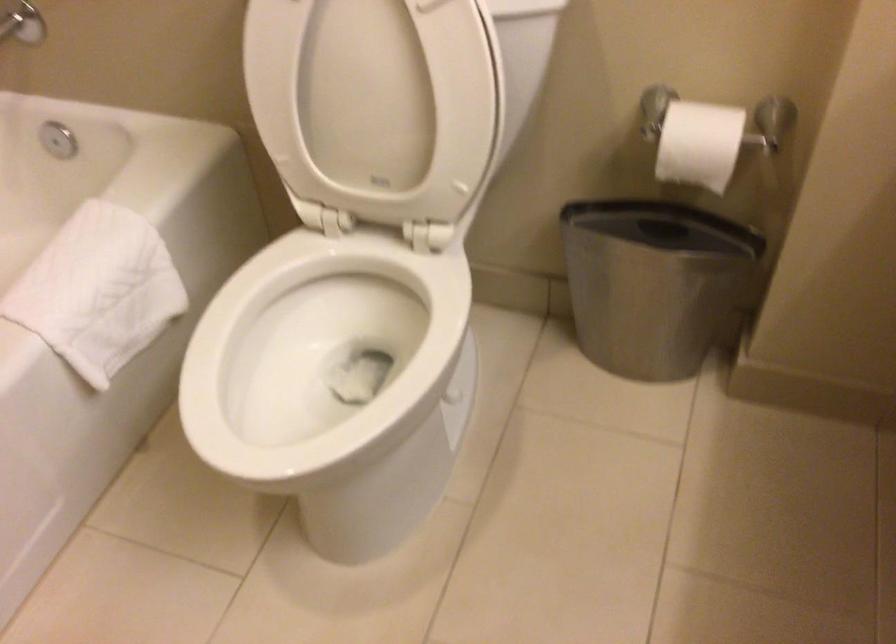
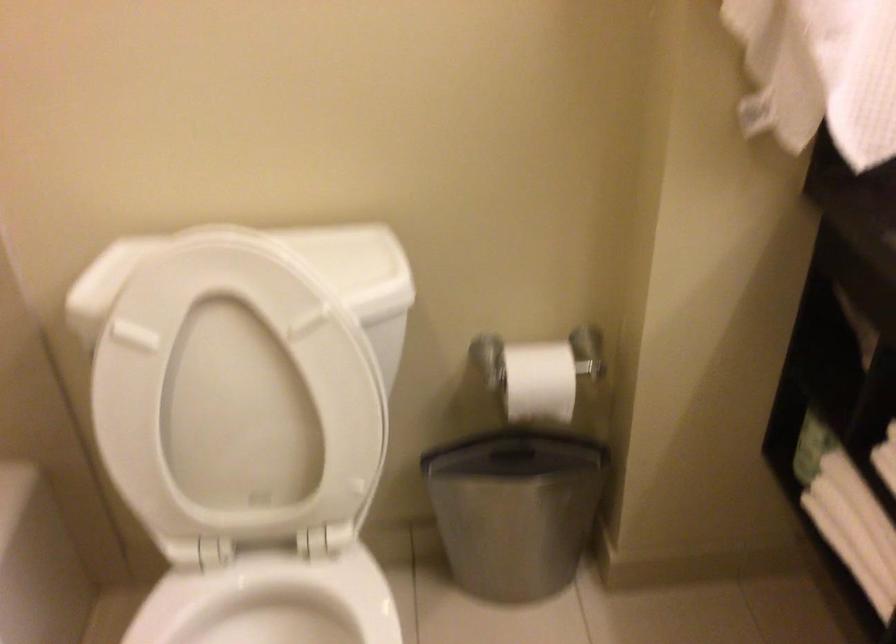
Question: In a continuous first-person perspective shot, in which direction is the camera moving?

Choices:
 (A) Left
 (B) Right
 (C) Forward
 (D) Backward

Answer: (A)